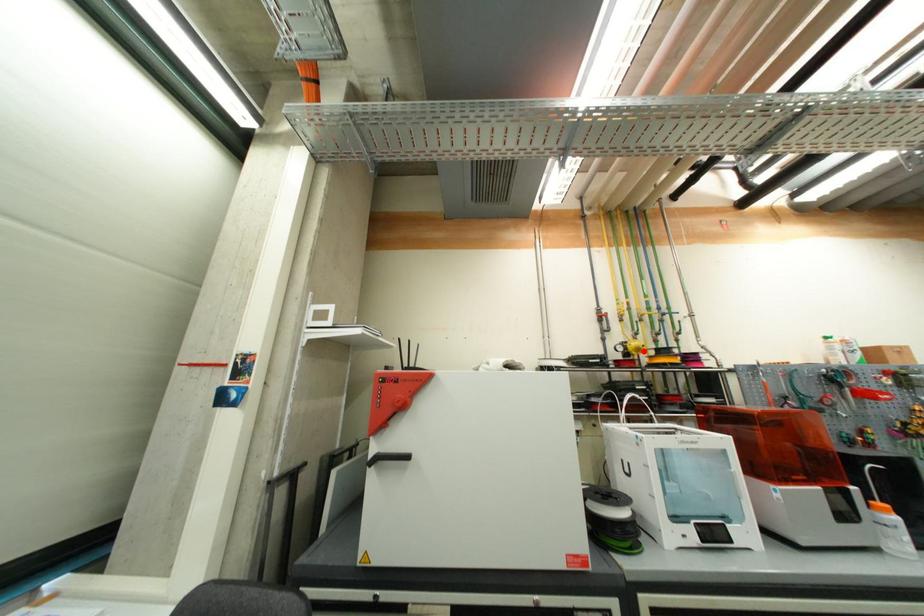
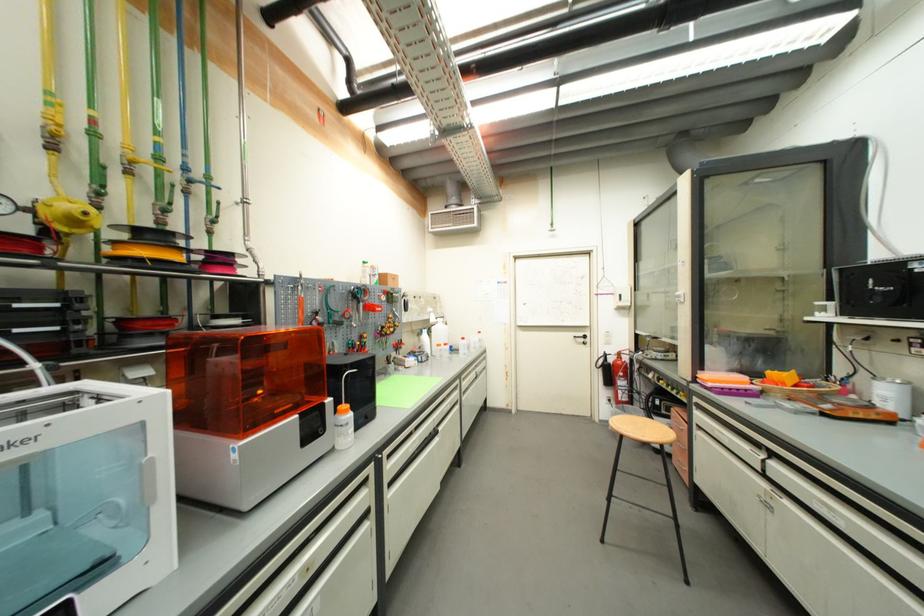
Locate, in the second image, the point that corresponds to the highlighted location in the first image.

(82, 224)